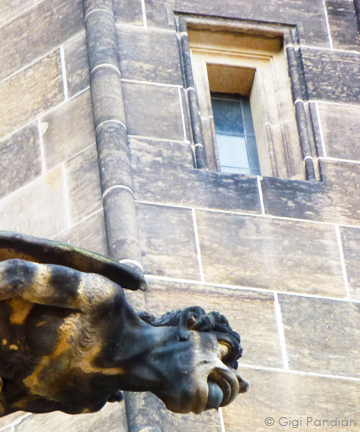
The width and height of the screenshot is (360, 432). Find the location of `chest`. chest is located at coordinates (58, 376).